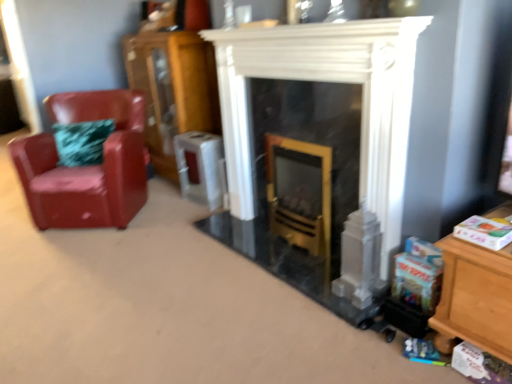
Find the location of a particular element. unoccupied area in front of glossy leather chair at left is located at coordinates (64, 257).